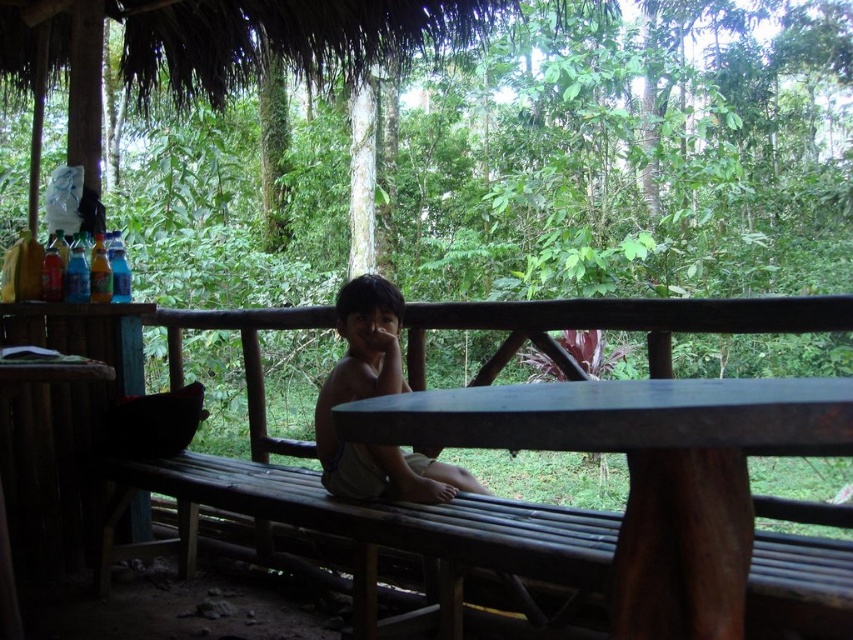
Which is below, smooth dark wood table at center or brown skin/softobject at center?

smooth dark wood table at center is below.

Measure the distance between smooth dark wood table at center and brown skin/softobject at center.

smooth dark wood table at center is 17.22 inches away from brown skin/softobject at center.

Between point (798, 445) and point (331, 420), which one is positioned behind?

Positioned behind is point (331, 420).

Locate an element on the screen. smooth dark wood table at center is located at coordinates (x=647, y=474).